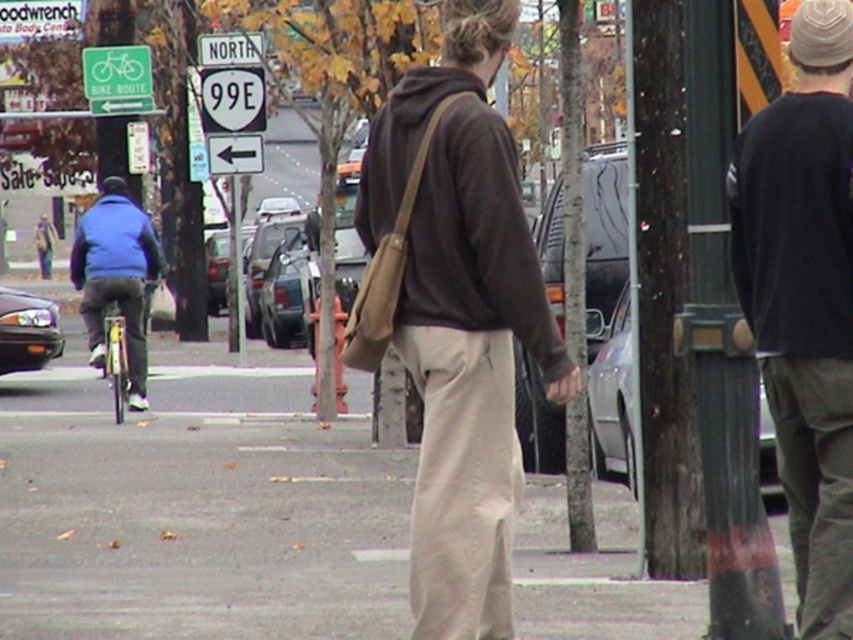
You are a pedestrian trying to cross the street safely. You notice two people in the scene, one wearing khaki pants at center and another in a blue fleece jacket at left. Which of these two individuals appears closer to you based on their size?

The khaki pants at center has a smaller size compared to blue fleece jacket at left, so the blue fleece jacket at left appears closer because larger objects are typically nearer in perspective.

In the scene shown: You are standing at the point labeled as point (131, 400) and want to walk to the point labeled as point (426, 380). Given that both points are on the sidewalk, which direction should you face to move towards your destination?

Since point (426, 380) is closer to the viewer than point (131, 400), you should face towards the direction of the viewer to move towards your destination.